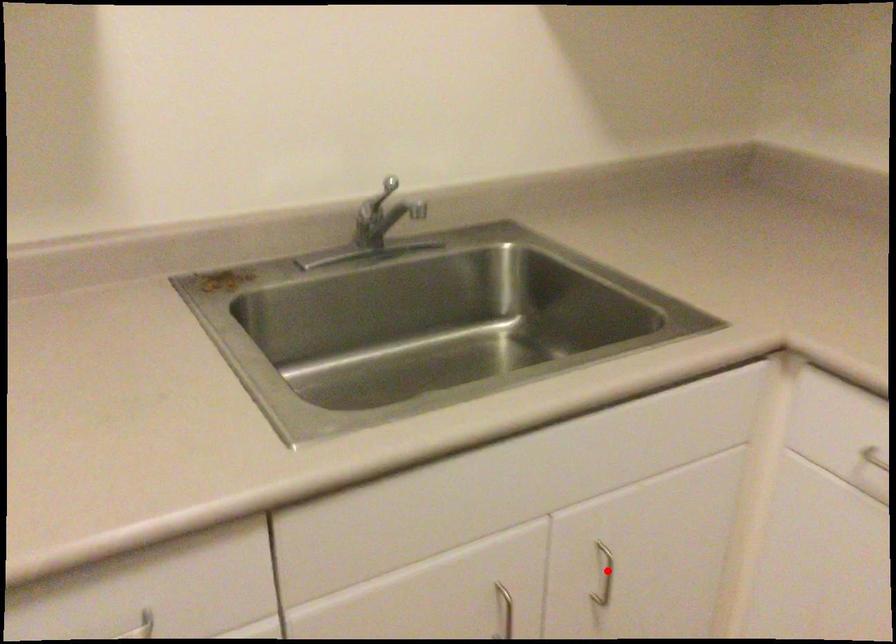
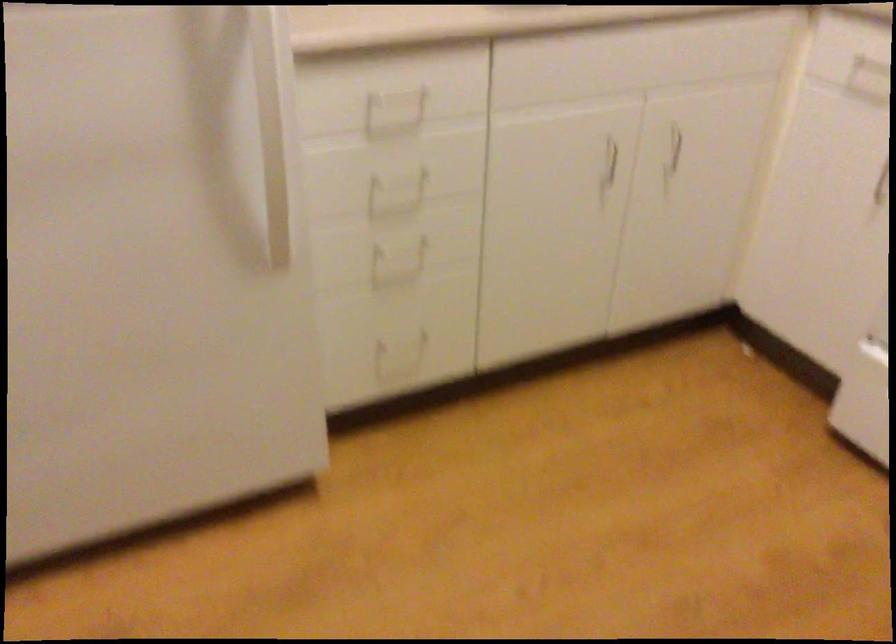
Locate, in the second image, the point that corresponds to the highlighted location in the first image.

(675, 147)